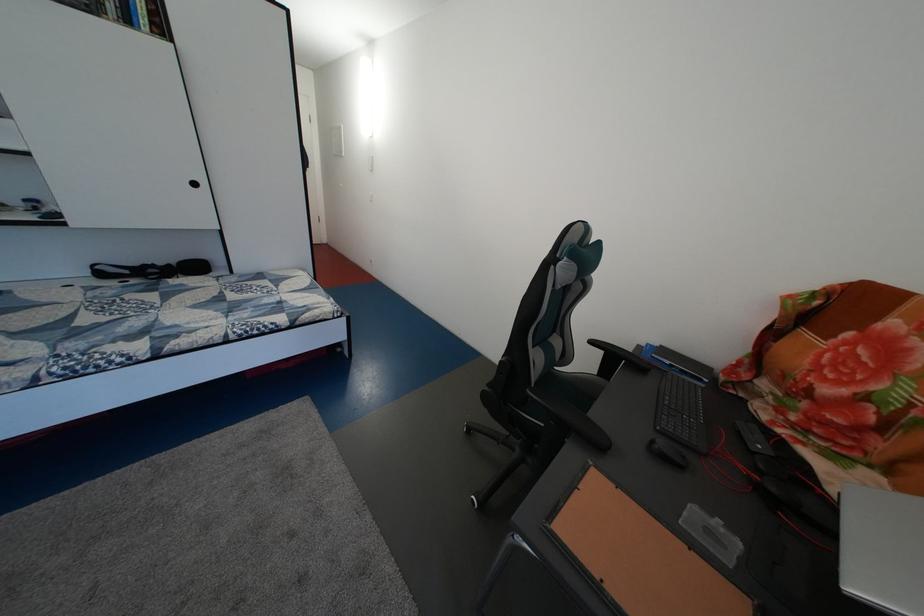
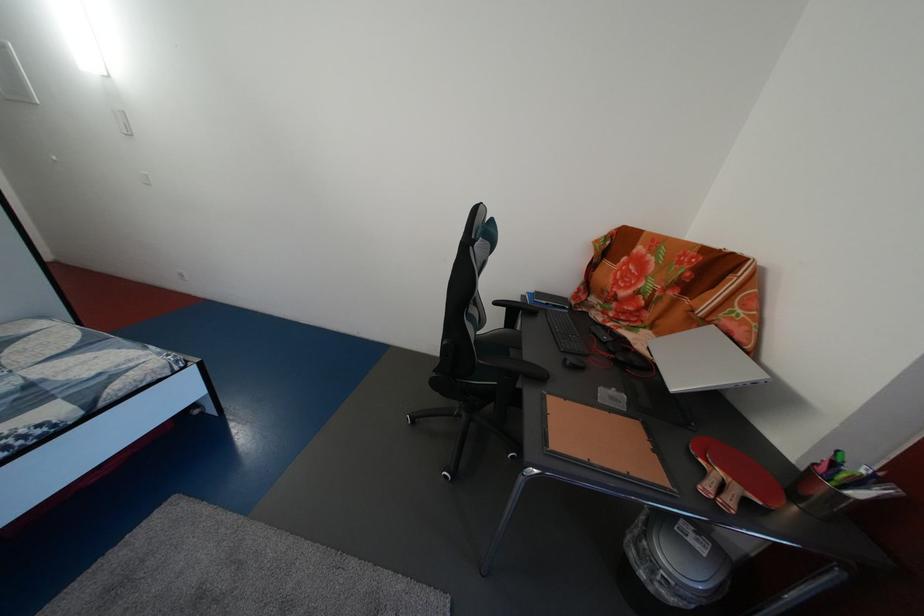
Locate, in the second image, the point that corresponds to point (880, 482) in the first image.

(657, 339)